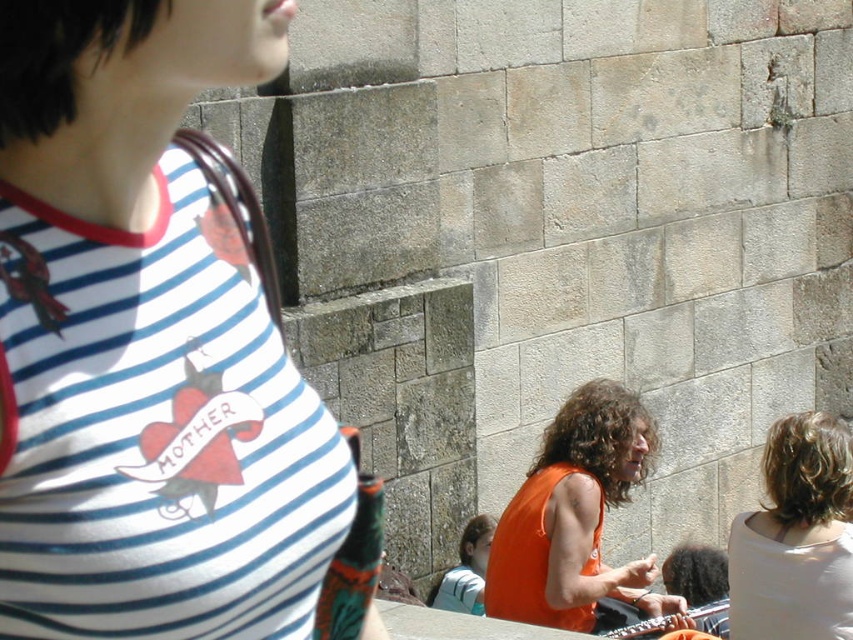
In the scene shown: You are standing in front of the stone wall and notice two points marked in the image. Which point, point (144,141) or point (636,580), is closer to you?

Point (144,141) is closer to the viewer than point (636,580).

You are standing in a public space near a stone wall and see a person with white matte hair at upper right and a light blue fabric shirt at lower center. Which object is positioned to the right side of the other?

A: The white matte hair at upper right is positioned to the right of the light blue fabric shirt at lower center.

You are an artist trying to sketch the scene. You need to place the white striped tank top at upper left in your drawing. Where should you place it on a coordinate system where the bottom left corner is the origin? Please provide coordinates as a tuple of two decimals rounded to three decimal places.

The white striped tank top at upper left should be placed at coordinates approximately (148, 340).